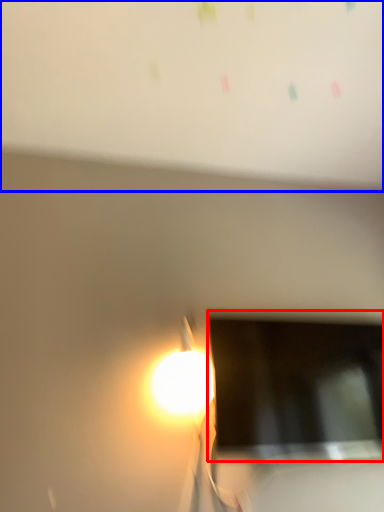
Question: Among these objects, which one is nearest to the camera, computer screen (highlighted by a red box) or bulletin board (highlighted by a blue box)?

Choices:
 (A) computer screen
 (B) bulletin board

Answer: (B)